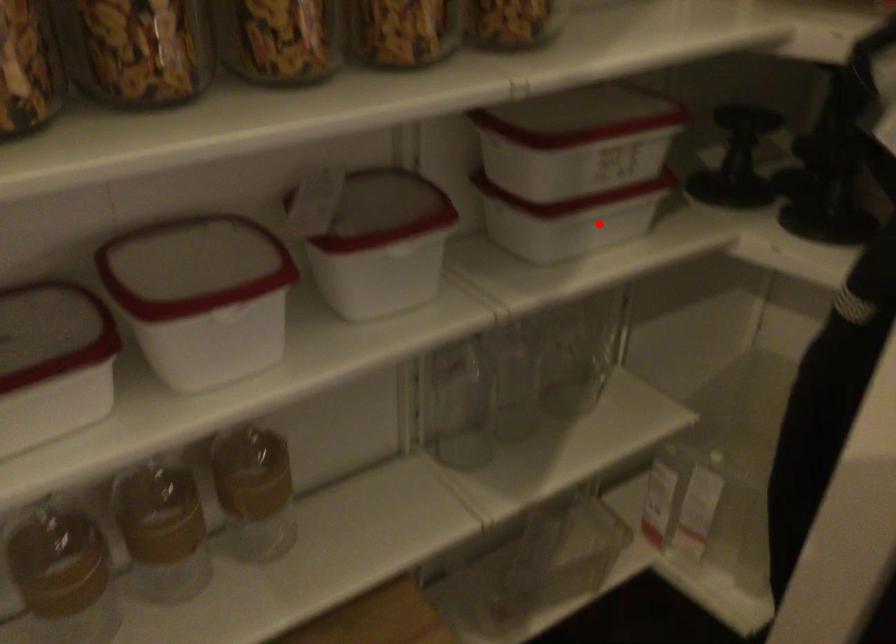
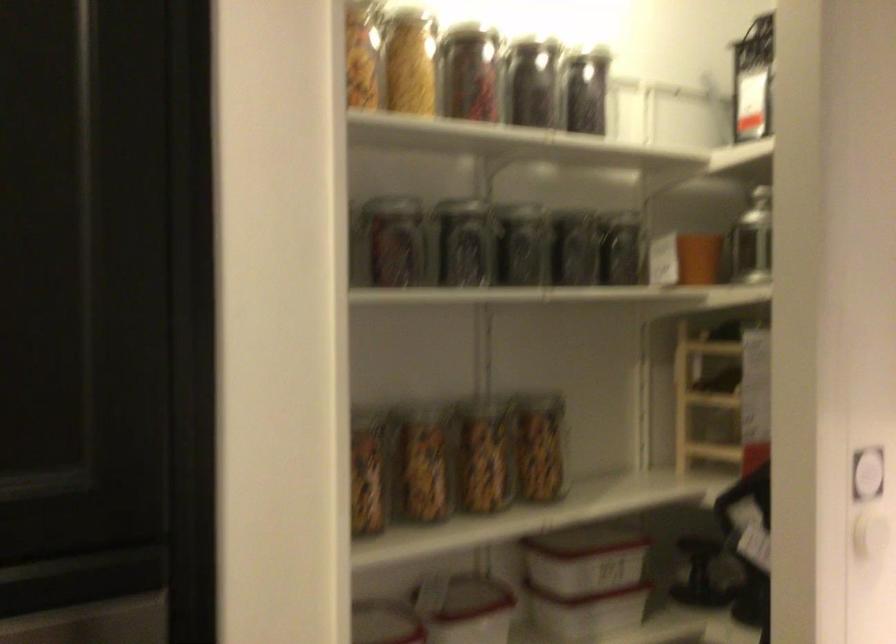
Locate, in the second image, the point that corresponds to the highlighted location in the first image.

(607, 614)